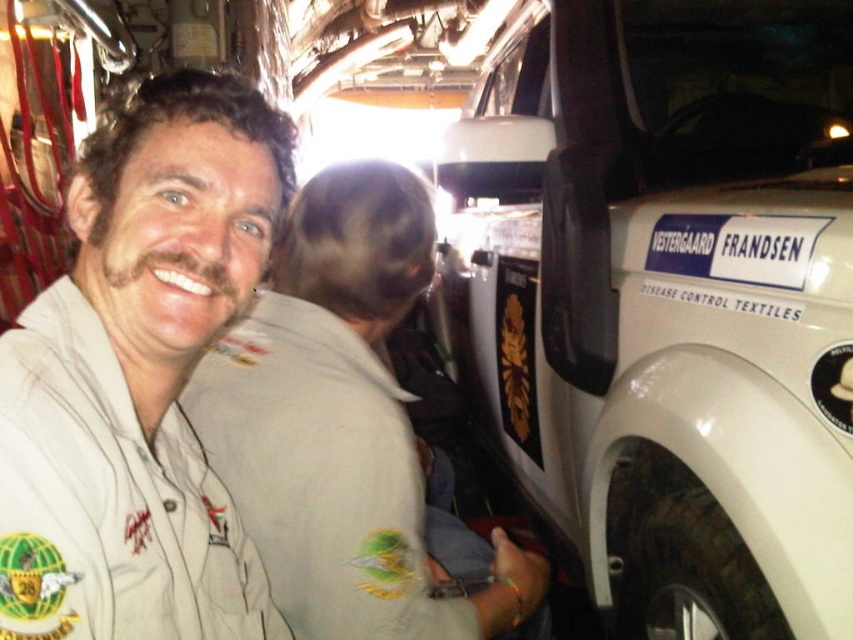
Question: Which point is farther from the camera taking this photo?

Choices:
 (A) (602, 38)
 (B) (436, 625)
 (C) (206, 541)

Answer: (A)

Question: Can you confirm if white matte shirt at upper left is wider than light brown uniform at left?

Choices:
 (A) yes
 (B) no

Answer: (B)

Question: Estimate the real-world distances between objects in this image. Which object is farther from the light brown uniform at left?

Choices:
 (A) white matte vehicle at right
 (B) white matte shirt at upper left

Answer: (A)

Question: Does white matte vehicle at right appear over light brown uniform at left?

Choices:
 (A) no
 (B) yes

Answer: (B)

Question: Which of the following is the farthest from the observer?

Choices:
 (A) (154, 388)
 (B) (625, 276)
 (C) (303, 257)

Answer: (B)

Question: Does white matte shirt at upper left come in front of light brown uniform at left?

Choices:
 (A) no
 (B) yes

Answer: (B)